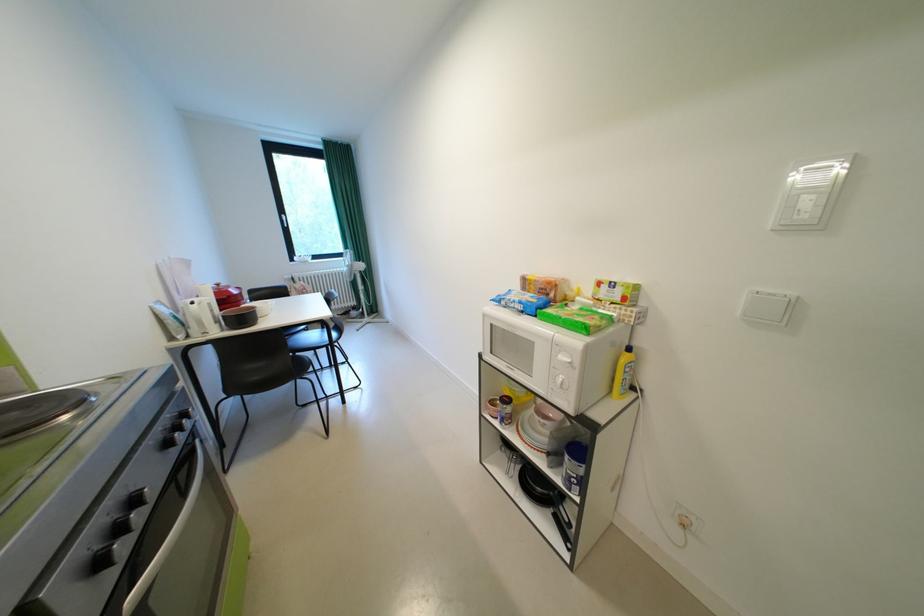
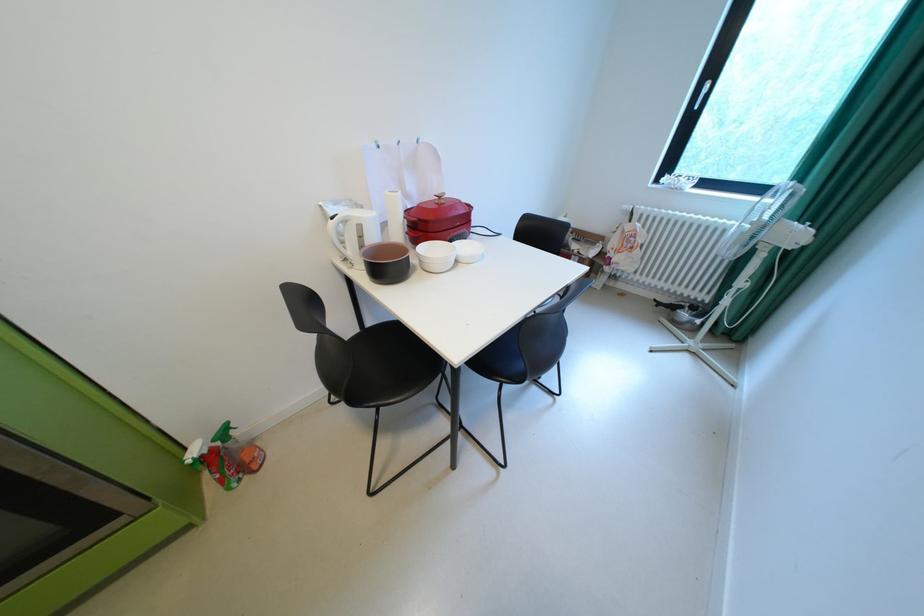
Where in the second image is the point corresponding to point 228,286 from the first image?

(450, 198)